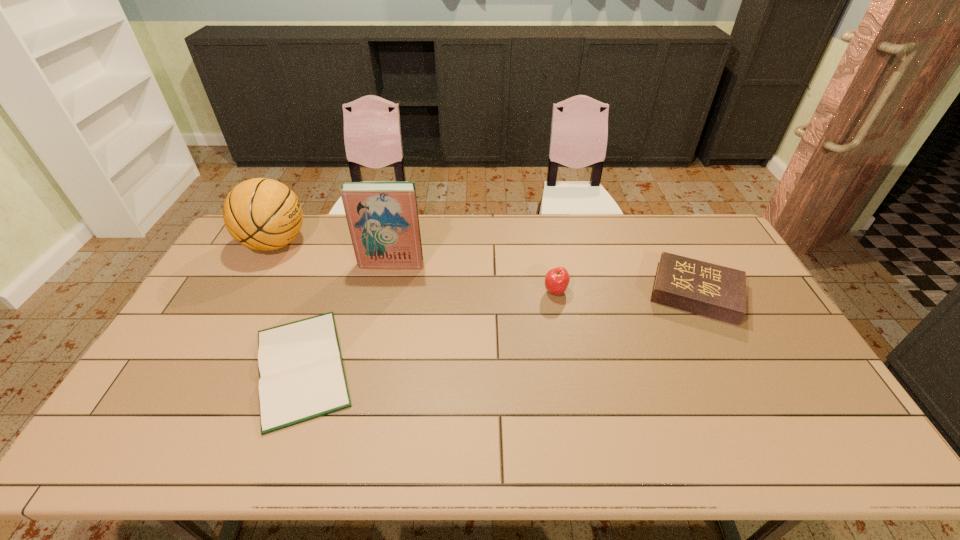
The image size is (960, 540). I want to click on vacant point that satisfies the following two spatial constraints: 1. on the surface of the basketball near the brand logo; 2. on the back side of the rightmost object, so click(x=249, y=293).

Locate an element on the screen. vacant space that satisfies the following two spatial constraints: 1. on the surface of the shortest hardback book near the brand logo; 2. on the left side of the second tallest object is located at coordinates (208, 367).

This screenshot has width=960, height=540. I want to click on free space that satisfies the following two spatial constraints: 1. on the surface of the second tallest object near the brand logo; 2. on the back side of the rightmost hardback book, so click(249, 293).